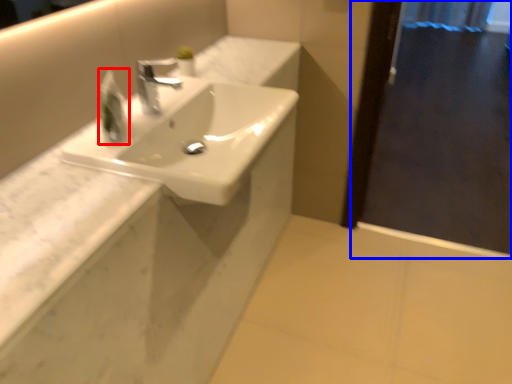
Question: Which point is further to the camera, soap dispenser (highlighted by a red box) or screen door (highlighted by a blue box)?

Choices:
 (A) soap dispenser
 (B) screen door

Answer: (B)